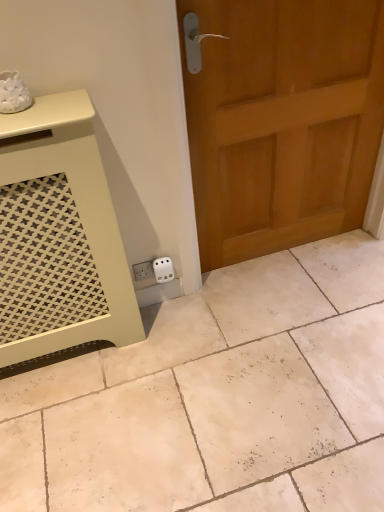
You are a GUI agent. You are given a task and a screenshot of the screen. Output one action in this format:
    pyautogui.click(x=<x>, y=<y>)
    Task: Click on the free space in front of matte cream vanity at lower left
    The width and height of the screenshot is (384, 512).
    Given the screenshot: What is the action you would take?
    pyautogui.click(x=87, y=423)